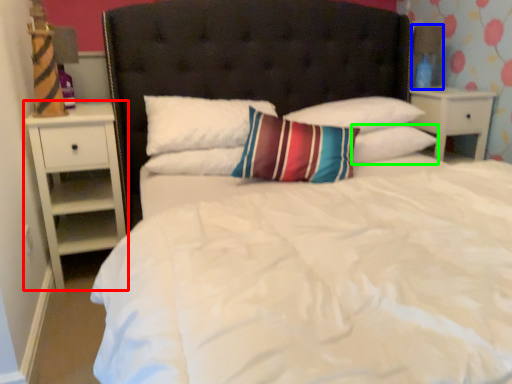
Question: Based on their relative distances, which object is nearer to nightstand (highlighted by a red box)? Choose from lamp (highlighted by a blue box) and pillow (highlighted by a green box).

Choices:
 (A) lamp
 (B) pillow

Answer: (B)